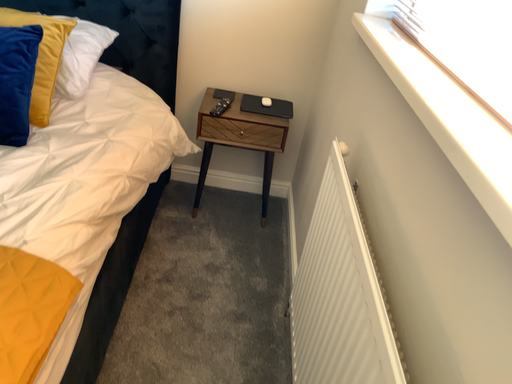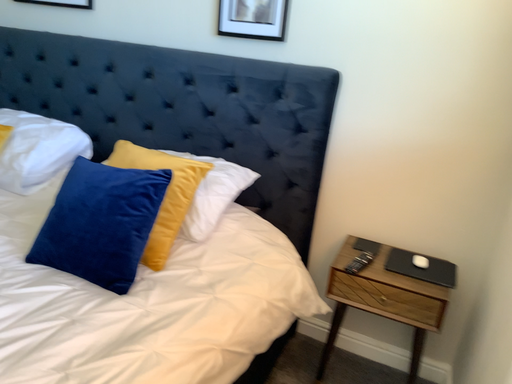
Question: Which way did the camera rotate in the video?

Choices:
 (A) rotated upward
 (B) rotated downward

Answer: (A)